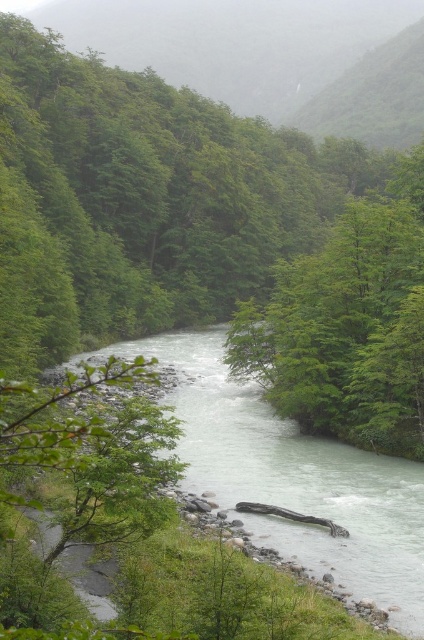
You are a hiker who wants to cross the river using a fallen log that is exactly 20 meters long. The green leafy tree at center and white smooth river at center are 22.49 meters apart from each other. Can you safely place the log between them to cross?

The distance between the green leafy tree at center and the white smooth river at center is 22.49 meters. Since the log is only 20 meters long, it would not be long enough to span the gap between them. Therefore, placing the log there would leave a gap of approximately 2.49 meters, making it unsafe to cross.